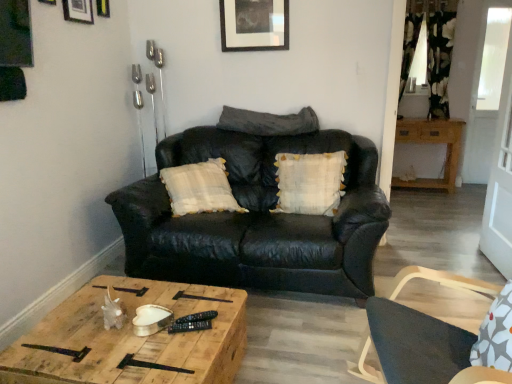
Question: Visually, is metallic silver picture frame at upper center, positioned as the 2th picture frame in back-to-front order, positioned to the left or to the right of matte black picture frame at upper left, which is counted as the 3th picture frame, starting from the right?

Choices:
 (A) left
 (B) right

Answer: (B)

Question: In terms of size, does metallic silver picture frame at upper center, positioned as the 2th picture frame in back-to-front order, appear bigger or smaller than matte black picture frame at upper left, which is counted as the second picture frame, starting from the front?

Choices:
 (A) small
 (B) big

Answer: (A)

Question: Which object is positioned closest to the matte black picture frame at upper center, marked as the first picture frame in a back-to-front arrangement?

Choices:
 (A) wooden cabinet at right, the 2th table viewed from the left
 (B) matte black chair at right
 (C) white textured pillow at center, which appears as the first pillow when ordered from the bottom
 (D) metallic silver picture frame at upper center, positioned as the 2th picture frame in back-to-front order
 (E) matte black picture frame at upper left, which is counted as the 3th picture frame, starting from the right

Answer: (D)

Question: Considering the real-world distances, which object is closest to the white textured pillow at center, positioned as the 2th pillow in top-to-bottom order?

Choices:
 (A) metallic silver picture frame at upper center, positioned as the 2th picture frame in back-to-front order
 (B) matte black picture frame at upper center, which is the 4th picture frame in left-to-right order
 (C) brushed metal picture frame at upper left, arranged as the 1th picture frame when viewed from the left
 (D) black leather couch at center
 (E) dark gray leather pillow at center, the second pillow from the bottom

Answer: (D)